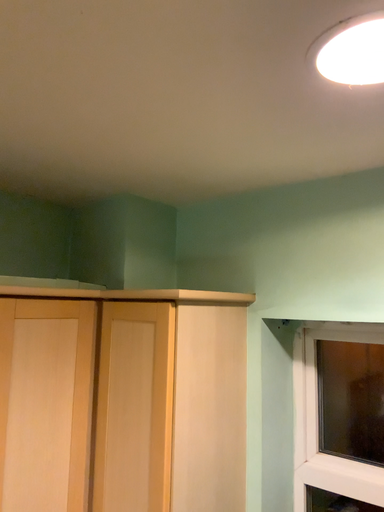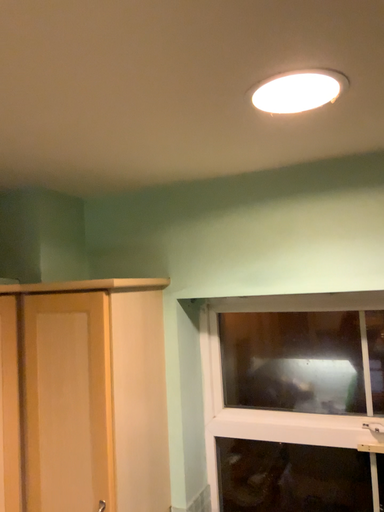
Question: How did the camera likely rotate when shooting the video?

Choices:
 (A) rotated right
 (B) rotated left

Answer: (A)